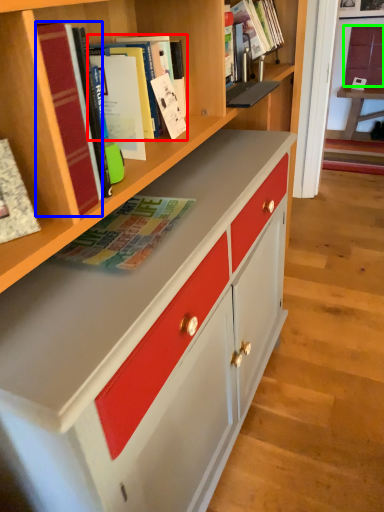
Question: Which object is positioned closest to book (highlighted by a red box)? Select from book (highlighted by a blue box) and cabinetry (highlighted by a green box).

Choices:
 (A) book
 (B) cabinetry

Answer: (A)